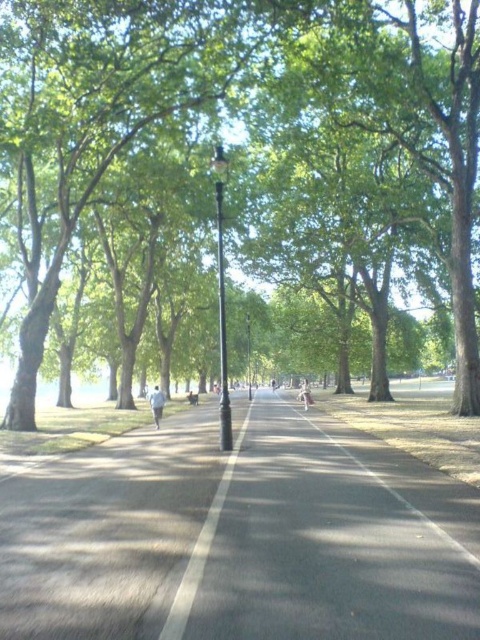
Question: Considering the real-world distances, which object is closest to the black metal lamp post at center?

Choices:
 (A) green leafy tree at center
 (B) black polished metal lamp post at center

Answer: (A)

Question: Can you confirm if black polished metal lamp post at center is positioned to the left of black metal lamp post at center?

Choices:
 (A) no
 (B) yes

Answer: (B)

Question: Does white smooth line at center appear on the right side of black polished metal lamp post at center?

Choices:
 (A) no
 (B) yes

Answer: (B)

Question: Which point is farther from the camera taking this photo?

Choices:
 (A) (245, 314)
 (B) (220, 394)

Answer: (A)

Question: Which point is closer to the camera taking this photo?

Choices:
 (A) (248, 339)
 (B) (286, 144)

Answer: (B)

Question: Can you confirm if black asphalt road at center is bigger than black polished metal lamp post at center?

Choices:
 (A) yes
 (B) no

Answer: (B)